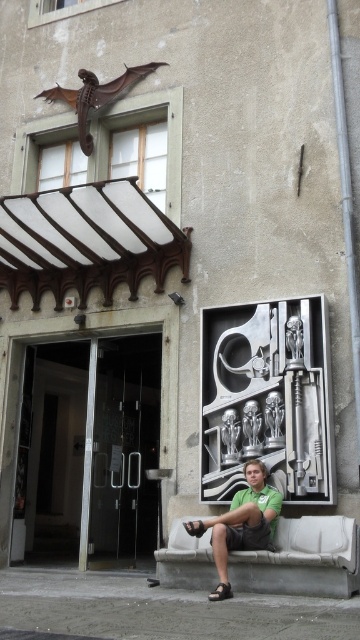
Question: Is white concrete bench at lower right wider than green matte shirt at center?

Choices:
 (A) yes
 (B) no

Answer: (A)

Question: Does white concrete bench at lower right come behind green matte shirt at center?

Choices:
 (A) no
 (B) yes

Answer: (A)

Question: Is white concrete bench at lower right positioned at the back of green matte shirt at center?

Choices:
 (A) yes
 (B) no

Answer: (B)

Question: Which object is farther from the camera taking this photo?

Choices:
 (A) green matte shirt at center
 (B) white concrete bench at lower right

Answer: (A)

Question: Among these objects, which one is nearest to the camera?

Choices:
 (A) white concrete bench at lower right
 (B) green matte shirt at center

Answer: (A)